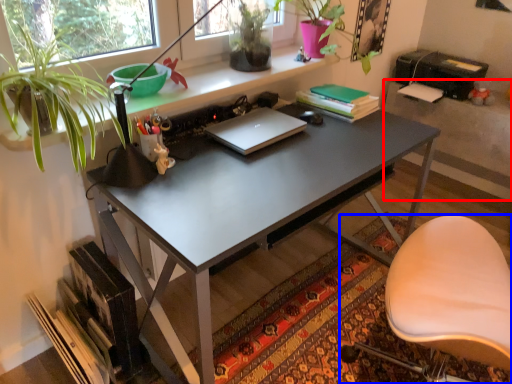
Question: Among these objects, which one is nearest to the camera, table (highlighted by a red box) or chair (highlighted by a blue box)?

Choices:
 (A) table
 (B) chair

Answer: (B)